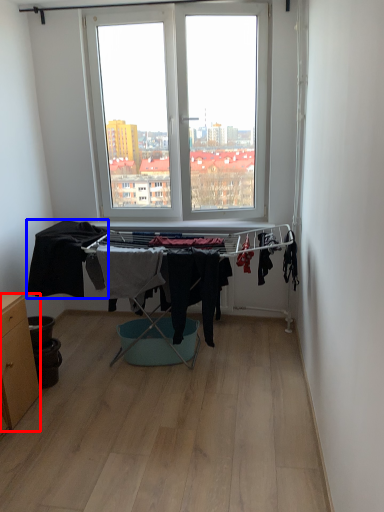
Question: Among these objects, which one is nearest to the camera, table (highlighted by a red box) or clothing (highlighted by a blue box)?

Choices:
 (A) table
 (B) clothing

Answer: (A)